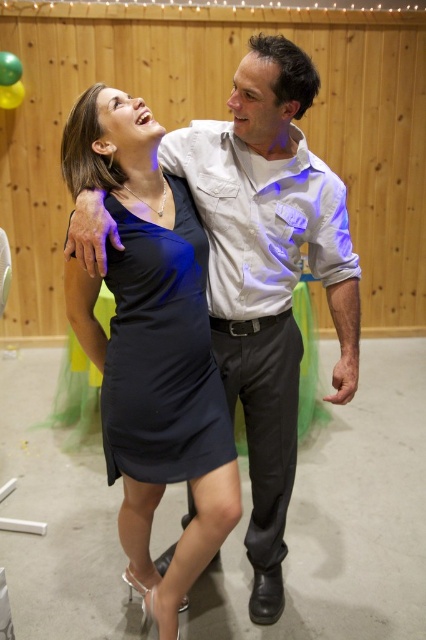
Does yellow rubber balloon at upper left have a lesser height compared to green matte balloon at upper left?

No, yellow rubber balloon at upper left is not shorter than green matte balloon at upper left.

Can you confirm if yellow rubber balloon at upper left is thinner than green matte balloon at upper left?

Yes.

Locate an element on the screen. The width and height of the screenshot is (426, 640). yellow rubber balloon at upper left is located at coordinates (9, 68).

Between black satin dress at center and green matte balloon at upper left, which one appears on the left side from the viewer's perspective?

Positioned to the left is green matte balloon at upper left.

Consider the image. Is the position of black satin dress at center less distant than that of green matte balloon at upper left?

Yes, it is.

Is point (149, 307) more distant than point (17, 97)?

No, it is in front of (17, 97).

The image size is (426, 640). What are the coordinates of `black satin dress at center` in the screenshot? It's located at (161, 353).

Who is higher up, satin black dress at center or yellow rubber balloon at upper left?

yellow rubber balloon at upper left

Which of these two, satin black dress at center or yellow rubber balloon at upper left, stands shorter?

With less height is yellow rubber balloon at upper left.

Is point (68, 157) less distant than point (0, 67)?

Yes.

In order to click on satin black dress at center in this screenshot , I will do `click(152, 346)`.